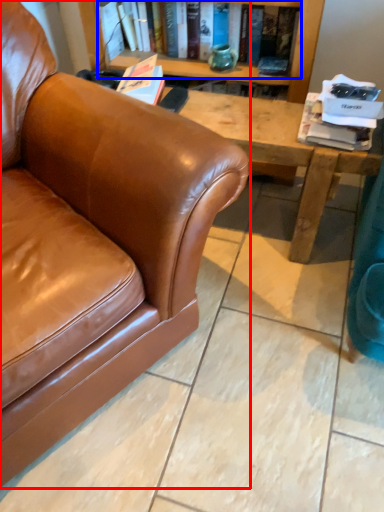
Question: Which of the following is the closest to the observer, studio couch (highlighted by a red box) or book (highlighted by a blue box)?

Choices:
 (A) studio couch
 (B) book

Answer: (A)